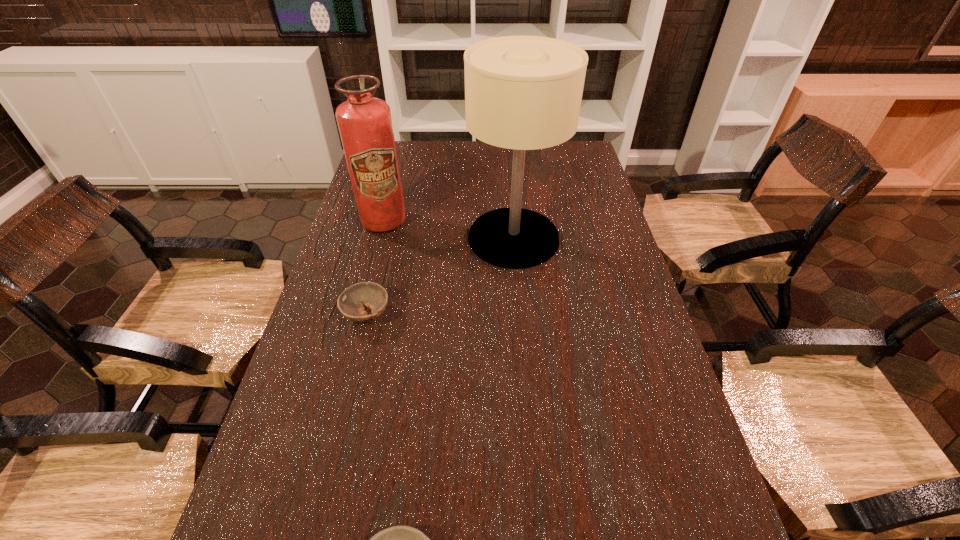
Choose which object is the third nearest neighbor to the fire extinguisher. Please provide its 2D coordinates. Your answer should be formatted as a tuple, i.e. [(x, y)], where the tuple contains the x and y coordinates of a point satisfying the conditions above.

[(398, 539)]

The height and width of the screenshot is (540, 960). Find the location of `vacant space that satisfies the following two spatial constraints: 1. on the label side of the fire extinguisher; 2. on the right side of the second shortest object`. vacant space that satisfies the following two spatial constraints: 1. on the label side of the fire extinguisher; 2. on the right side of the second shortest object is located at coordinates (359, 315).

The width and height of the screenshot is (960, 540). In order to click on free location that satisfies the following two spatial constraints: 1. on the back side of the taller bowl; 2. on the left side of the table lamp in this screenshot , I will do `click(385, 238)`.

Identify the location of vacant space that satisfies the following two spatial constraints: 1. on the label side of the fire extinguisher; 2. on the right side of the farther bowl. This screenshot has height=540, width=960. (359, 315).

This screenshot has width=960, height=540. I want to click on vacant space that satisfies the following two spatial constraints: 1. on the label side of the farther bowl; 2. on the right side of the fire extinguisher, so click(359, 315).